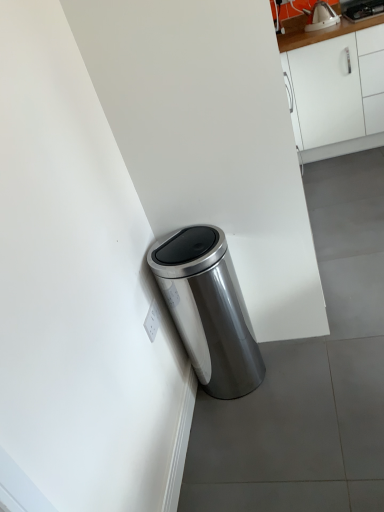
Question: From the image's perspective, is satin silver trash can at lower left below metallic silver kettle at upper right?

Choices:
 (A) no
 (B) yes

Answer: (B)

Question: Considering the relative sizes of satin silver trash can at lower left and metallic silver kettle at upper right in the image provided, is satin silver trash can at lower left thinner than metallic silver kettle at upper right?

Choices:
 (A) no
 (B) yes

Answer: (B)

Question: Is satin silver trash can at lower left outside metallic silver kettle at upper right?

Choices:
 (A) no
 (B) yes

Answer: (B)

Question: Would you consider satin silver trash can at lower left to be distant from metallic silver kettle at upper right?

Choices:
 (A) no
 (B) yes

Answer: (B)

Question: Is metallic silver kettle at upper right at the back of satin silver trash can at lower left?

Choices:
 (A) yes
 (B) no

Answer: (B)

Question: Considering the positions of white plastic electric outlet at lower left and satin silver trash can at lower left in the image, is white plastic electric outlet at lower left taller or shorter than satin silver trash can at lower left?

Choices:
 (A) short
 (B) tall

Answer: (A)

Question: In terms of size, does white plastic electric outlet at lower left appear bigger or smaller than satin silver trash can at lower left?

Choices:
 (A) big
 (B) small

Answer: (B)

Question: From a real-world perspective, relative to satin silver trash can at lower left, is white plastic electric outlet at lower left vertically above or below?

Choices:
 (A) below
 (B) above

Answer: (B)

Question: Is white plastic electric outlet at lower left to the left or to the right of satin silver trash can at lower left in the image?

Choices:
 (A) left
 (B) right

Answer: (A)

Question: Considering the positions of white matte cabinet at upper right and white plastic electric outlet at lower left in the image, is white matte cabinet at upper right taller or shorter than white plastic electric outlet at lower left?

Choices:
 (A) tall
 (B) short

Answer: (A)

Question: From a real-world perspective, is white matte cabinet at upper right above or below white plastic electric outlet at lower left?

Choices:
 (A) above
 (B) below

Answer: (A)

Question: Based on their sizes in the image, would you say white matte cabinet at upper right is bigger or smaller than white plastic electric outlet at lower left?

Choices:
 (A) small
 (B) big

Answer: (B)

Question: Looking at their shapes, would you say white matte cabinet at upper right is wider or thinner than white plastic electric outlet at lower left?

Choices:
 (A) thin
 (B) wide

Answer: (B)

Question: Is satin silver trash can at lower left situated inside metallic silver kettle at upper right or outside?

Choices:
 (A) inside
 (B) outside

Answer: (B)

Question: From the image's perspective, relative to metallic silver kettle at upper right, is satin silver trash can at lower left above or below?

Choices:
 (A) below
 (B) above

Answer: (A)